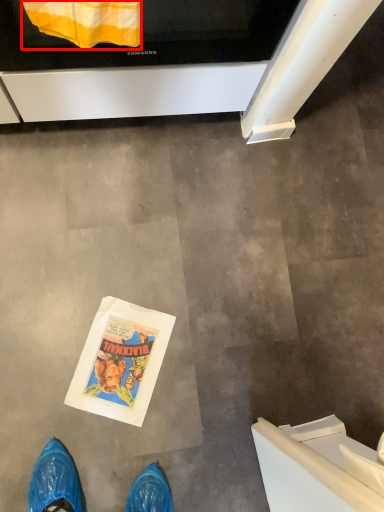
Question: From the image, what is the correct spatial relationship of blanket (annotated by the red box) in relation to oven?

Choices:
 (A) right
 (B) left

Answer: (B)